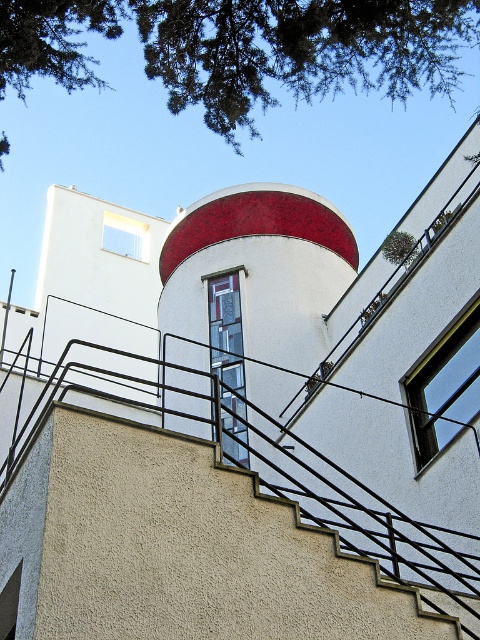
You are an architect evaluating the structural integrity of the building. Considering the smooth red tower at center and the clear glass window at upper right, which object would require more reinforcement due to its size?

The smooth red tower at center requires more reinforcement because it is larger in size than the clear glass window at upper right.

Based on the photo, you are standing in front of the modern architectural structure and notice a green leafy tree at upper left. Based on its position coordinates, can you determine if it is closer to the left edge or the right edge of the image?

The green leafy tree at upper left is located at point 0.077 on the x and y coordinates, which places it closer to the left edge of the image.

You are standing in front of the modern architectural structure and see a point marked at coordinates (245, 49). What object is located at that point?

The point at coordinates (245, 49) indicates a green leafy tree at upper left.